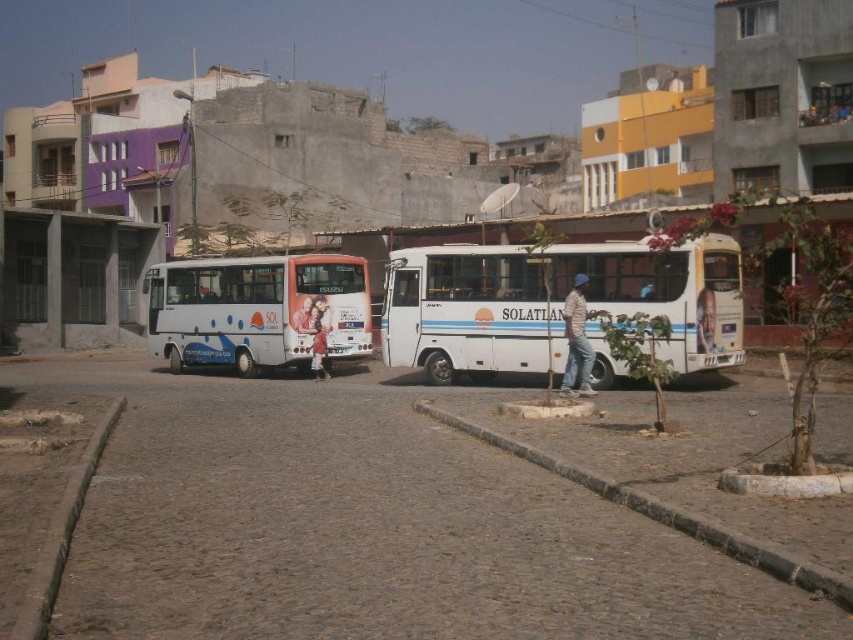
Is brown concrete curb at lower left smaller than light pink fabric at center?

No.

This screenshot has width=853, height=640. What do you see at coordinates (61, 534) in the screenshot? I see `brown concrete curb at lower left` at bounding box center [61, 534].

I want to click on brown concrete curb at lower left, so click(x=61, y=534).

Between point (22, 260) and point (315, 368), which one is positioned behind?

The point (22, 260) is more distant.

This screenshot has width=853, height=640. What do you see at coordinates (71, 278) in the screenshot? I see `white concrete bus stop at left` at bounding box center [71, 278].

Locate an element on the screen. The width and height of the screenshot is (853, 640). white concrete bus stop at left is located at coordinates (71, 278).

Who is more distant from viewer, (460, 349) or (509, 435)?

Positioned behind is point (460, 349).

This screenshot has height=640, width=853. Describe the element at coordinates (550, 301) in the screenshot. I see `white matte bus at center` at that location.

Which is in front, point (398, 276) or point (795, 573)?

Positioned in front is point (795, 573).

Where is `white matte bus at center`? The image size is (853, 640). white matte bus at center is located at coordinates [x=550, y=301].